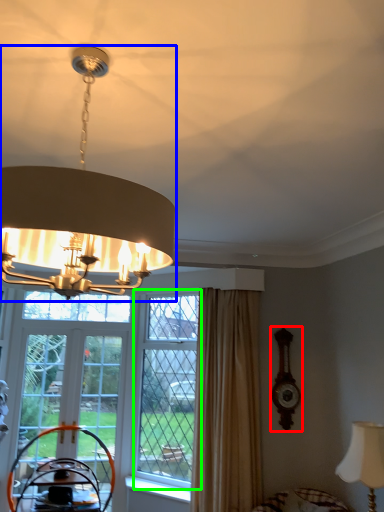
Question: Which object is the closest to the clock (highlighted by a red box)? Choose among these: lamp (highlighted by a blue box) or window (highlighted by a green box).

Choices:
 (A) lamp
 (B) window

Answer: (B)